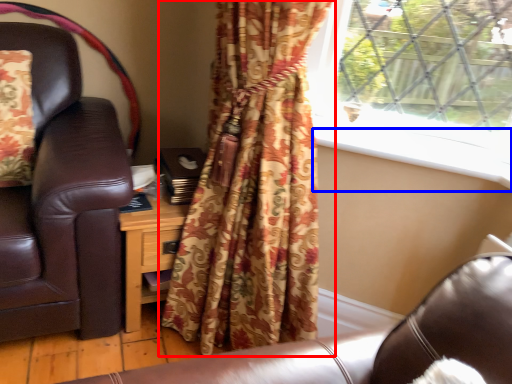
Question: Which object is closer to the camera taking this photo, curtain (highlighted by a red box) or window sill (highlighted by a blue box)?

Choices:
 (A) curtain
 (B) window sill

Answer: (A)